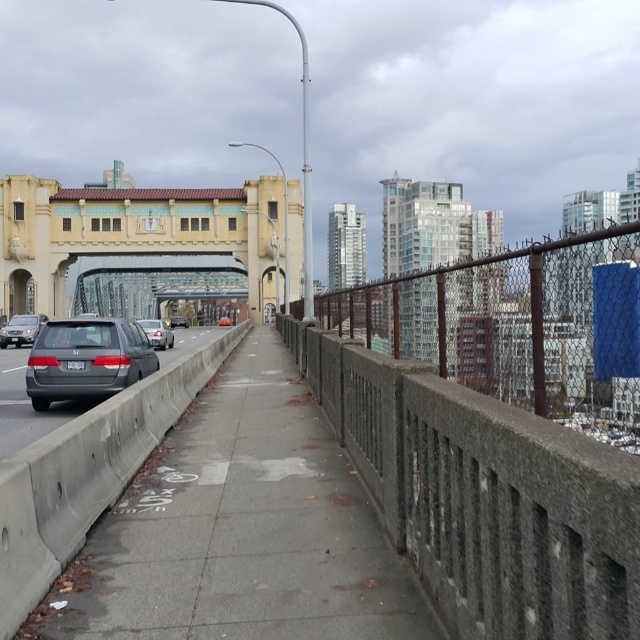
Who is higher up, rusty chain-link fence at center-right or matte silver sedan at center?

Positioned higher is rusty chain-link fence at center-right.

Looking at this image, can you confirm if rusty chain-link fence at center-right is thinner than matte silver sedan at center?

No.

The image size is (640, 640). In order to click on rusty chain-link fence at center-right in this screenshot , I will do `click(520, 326)`.

Does matte gray minivan at left appear over matte gray sedan at left?

No, matte gray minivan at left is not above matte gray sedan at left.

Who is more distant from viewer, [65,353] or [26,326]?

Positioned behind is point [26,326].

Is point (148, 355) positioned before point (19, 346)?

Yes, it is.

Where is `matte gray minivan at left`? matte gray minivan at left is located at coordinates (86, 358).

Which is more to the right, matte gray sedan at left or matte silver sedan at center?

Positioned to the right is matte silver sedan at center.

Is point (1, 328) closer to camera compared to point (154, 324)?

No, it is behind (154, 324).

Is point (44, 321) behind point (148, 336)?

Yes, point (44, 321) is behind point (148, 336).

The height and width of the screenshot is (640, 640). I want to click on matte gray sedan at left, so (20, 330).